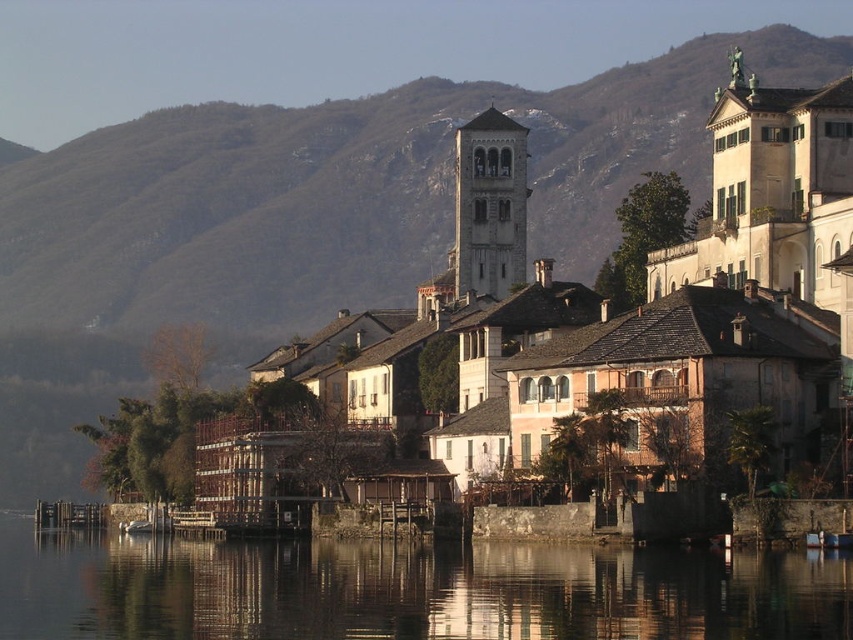
You are a tourist standing at the lakeside and want to take a photo of the transparent water at lower center and the gray stone bell tower at center. Which object in the scene will appear larger in your photo?

The gray stone bell tower at center will appear larger in the photo because the transparent water at lower center has a smaller size compared to it.

Consider the image. You are standing at the lakeside and want to take a photo of both the transparent water at lower center and the gray stone bell tower at center. Which object will appear larger in your photo?

The transparent water at lower center will appear larger in the photo because it is closer to the viewer than the gray stone bell tower at center.

You are standing at the lakeside and want to take a photo that includes both the point at coordinates point (349,589) and the point at coordinates point (479,154). Since one is closer to you than the other, which point should you focus on first to ensure both are in focus?

You should focus on the point at coordinates point (479,154) first because it is farther away from you than point (349,589). This way, the depth of field will likely include both points when focusing on the farther one.